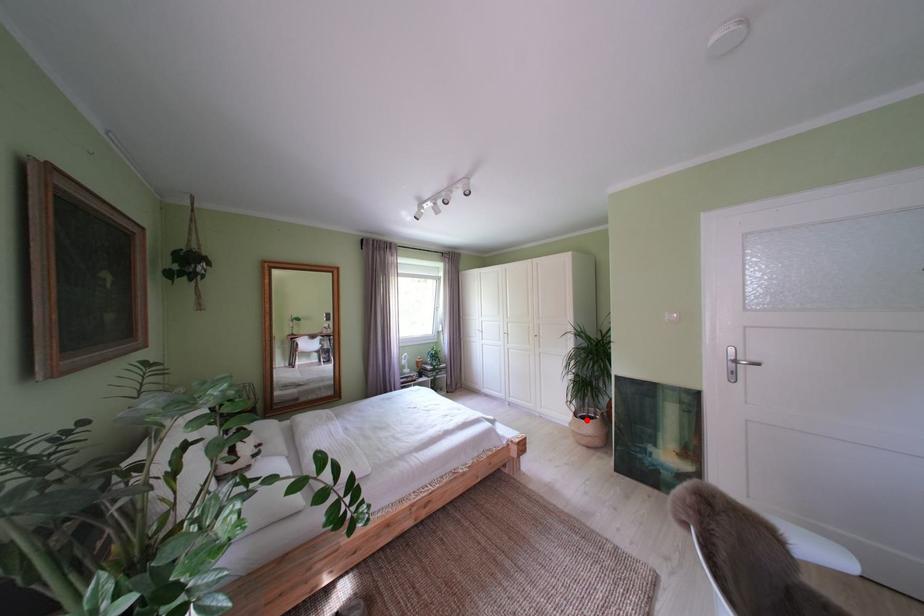
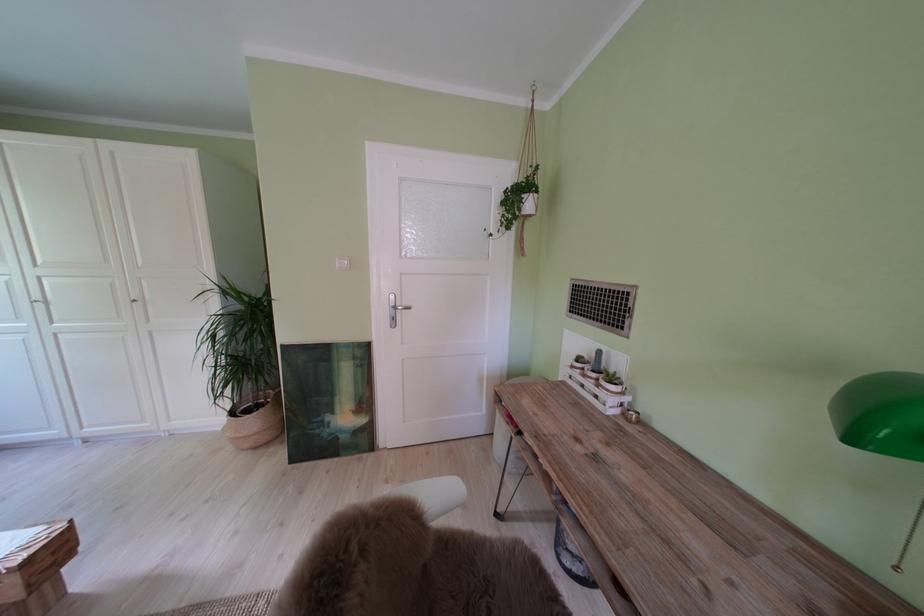
The point at the highlighted location is marked in the first image. Where is the corresponding point in the second image?

(242, 418)